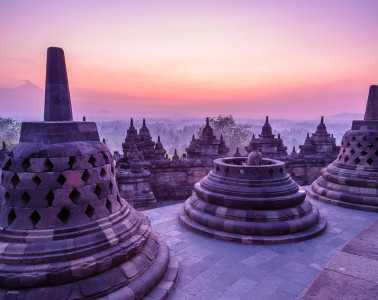
Where is `floor`? This screenshot has height=300, width=378. floor is located at coordinates (280, 274).